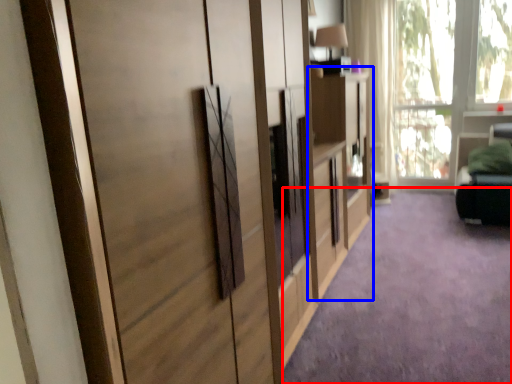
Question: Among these objects, which one is farthest to the camera, plain (highlighted by a red box) or dresser (highlighted by a blue box)?

Choices:
 (A) plain
 (B) dresser

Answer: (B)